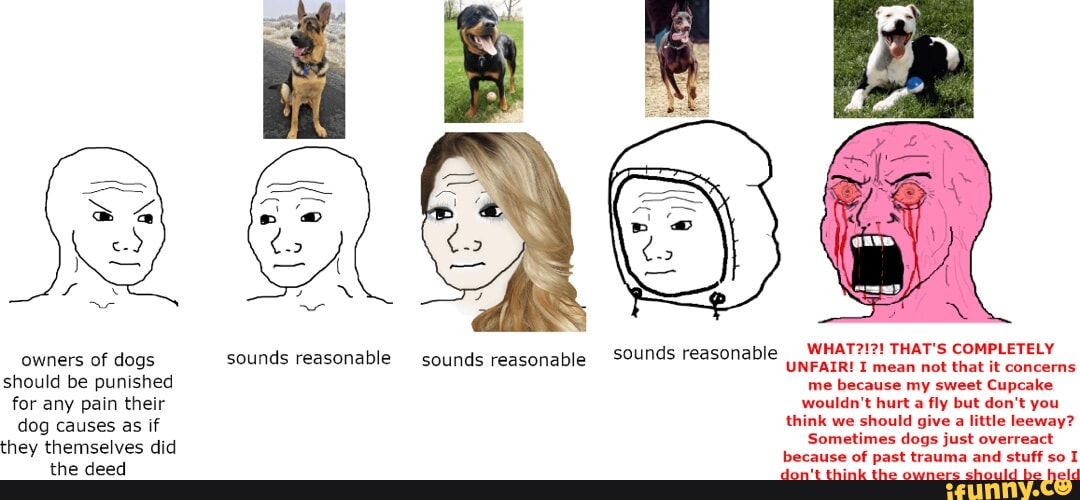
This screenshot has width=1080, height=500. Identify the location of hood. (742, 139).